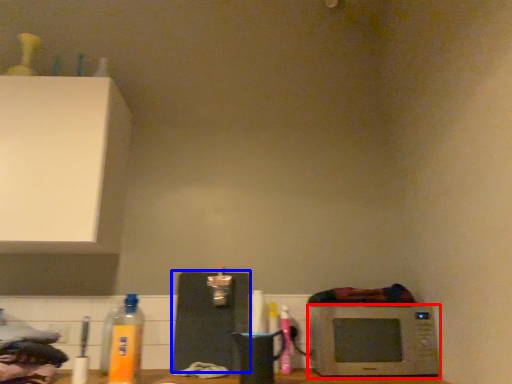
Question: Which object appears farthest to the camera in this image, microwave oven (highlighted by a red box) or appliance (highlighted by a blue box)?

Choices:
 (A) microwave oven
 (B) appliance

Answer: (B)